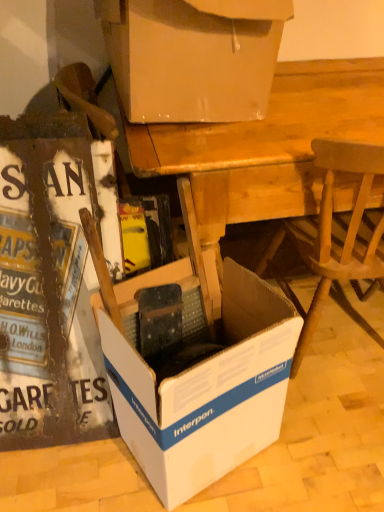
Question: Does white cardboard box at center, the third box viewed from the top, have a lesser height compared to wooden chair at lower right?

Choices:
 (A) no
 (B) yes

Answer: (B)

Question: Is white cardboard box at center, the 1th box from the bottom, turned away from wooden chair at lower right?

Choices:
 (A) yes
 (B) no

Answer: (B)

Question: Are white cardboard box at center, the third box viewed from the top, and wooden chair at lower right making contact?

Choices:
 (A) no
 (B) yes

Answer: (A)

Question: Is white cardboard box at center, the third box viewed from the top, behind wooden chair at lower right?

Choices:
 (A) no
 (B) yes

Answer: (A)

Question: From a real-world perspective, does white cardboard box at center, the 1th box from the bottom, stand above wooden chair at lower right?

Choices:
 (A) yes
 (B) no

Answer: (B)

Question: Is white cardboard box at center, the 1th box from the bottom, not inside wooden chair at lower right?

Choices:
 (A) no
 (B) yes

Answer: (B)

Question: From the image's perspective, is wooden desk at center under white cardboard box at upper center, placed as the 3th box when sorted from bottom to top?

Choices:
 (A) no
 (B) yes

Answer: (B)

Question: From a real-world perspective, is wooden desk at center located higher than white cardboard box at upper center, which is the first box from top to bottom?

Choices:
 (A) no
 (B) yes

Answer: (A)

Question: Does wooden desk at center have a smaller size compared to white cardboard box at upper center, placed as the 3th box when sorted from bottom to top?

Choices:
 (A) yes
 (B) no

Answer: (B)

Question: Can you confirm if wooden desk at center is thinner than white cardboard box at upper center, which is the first box from top to bottom?

Choices:
 (A) no
 (B) yes

Answer: (A)

Question: Is wooden desk at center outside white cardboard box at upper center, placed as the 3th box when sorted from bottom to top?

Choices:
 (A) no
 (B) yes

Answer: (B)

Question: Does wooden desk at center lie in front of white cardboard box at upper center, placed as the 3th box when sorted from bottom to top?

Choices:
 (A) no
 (B) yes

Answer: (A)

Question: From the image's perspective, does white cardboard box at lower left, the second box from the top, appear lower than wooden desk at center?

Choices:
 (A) no
 (B) yes

Answer: (B)